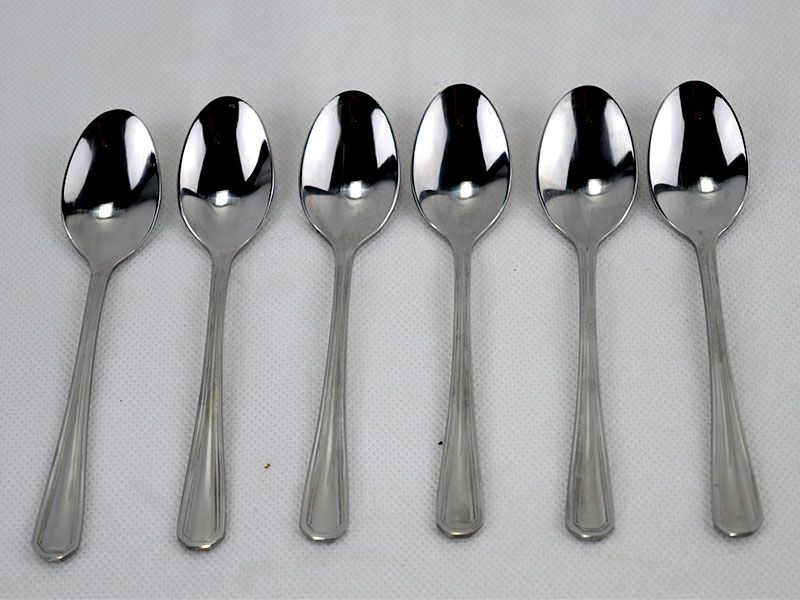
Locate an element on the screen. spoons is located at coordinates (692, 232), (596, 225), (464, 220), (356, 216), (240, 219), (102, 228).